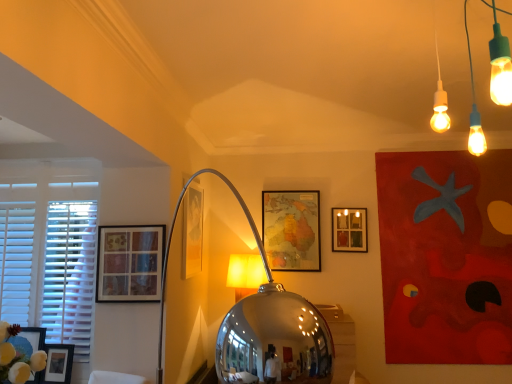
Find the location of a particular element. This screenshot has height=384, width=512. matte glass picture frame at center, arranged as the 3th picture frame when viewed from the right is located at coordinates click(x=192, y=231).

Describe the element at coordinates (130, 263) in the screenshot. The height and width of the screenshot is (384, 512). I see `matte glass picture frame at left, acting as the fourth picture frame starting from the right` at that location.

This screenshot has width=512, height=384. I want to click on matte glass picture frame at upper center, the fifth picture frame in the left-to-right sequence, so click(349, 230).

How much space does matte glass picture frame at upper center, the fifth picture frame in the left-to-right sequence, occupy vertically?

15.94 inches.

This screenshot has height=384, width=512. What do you see at coordinates (58, 363) in the screenshot?
I see `matte black picture frame at lower left, which is the fourth picture frame in back-to-front order` at bounding box center [58, 363].

You are a GUI agent. You are given a task and a screenshot of the screen. Output one action in this format:
    pyautogui.click(x=<x>, y=<y>)
    Task: Click on the matte wooden map at center, the 1th picture frame from the back
    
    Given the screenshot: What is the action you would take?
    pyautogui.click(x=291, y=230)

Measure the distance between point (274, 244) and camera.

A distance of 3.84 meters exists between point (274, 244) and camera.

This screenshot has height=384, width=512. I want to click on white matte window at left, so click(50, 247).

Looking at the image, does matte glass picture frame at left, acting as the fourth picture frame starting from the right, seem bigger or smaller compared to shiny metallic table lamp at center?

Considering their sizes, matte glass picture frame at left, acting as the fourth picture frame starting from the right, takes up less space than shiny metallic table lamp at center.

Can we say matte glass picture frame at left, which is the second picture frame in left-to-right order, lies outside shiny metallic table lamp at center?

Yes, matte glass picture frame at left, which is the second picture frame in left-to-right order, is not within shiny metallic table lamp at center.

Based on the photo, which of these two, matte glass picture frame at left, acting as the fourth picture frame starting from the right, or shiny metallic table lamp at center, stands shorter?

Standing shorter between the two is matte glass picture frame at left, acting as the fourth picture frame starting from the right.

At what (x,y) coordinates should I click in order to perform the action: click on the 1st picture frame above the shiny metallic table lamp at center (from the image's perspective). Please return your answer as a coordinate pair (x, y). The image size is (512, 384). Looking at the image, I should click on (130, 263).

Who is bigger, matte glass picture frame at center, marked as the 3th picture frame in a back-to-front arrangement, or shiny metallic table lamp at center?

shiny metallic table lamp at center is bigger.

From a real-world perspective, is matte glass picture frame at center, marked as the 3th picture frame in a back-to-front arrangement, positioned above or below shiny metallic table lamp at center?

In terms of real-world spatial position, matte glass picture frame at center, marked as the 3th picture frame in a back-to-front arrangement, is above shiny metallic table lamp at center.

Considering the positions of point (198, 271) and point (263, 278), is point (198, 271) closer or farther from the camera than point (263, 278)?

Point (198, 271).

From a real-world perspective, is shiny metallic table lamp at center positioned above or below matte glass picture frame at upper center, the fifth picture frame in the left-to-right sequence?

shiny metallic table lamp at center is below matte glass picture frame at upper center, the fifth picture frame in the left-to-right sequence.

What's the angular difference between shiny metallic table lamp at center and matte glass picture frame at upper center, the 2th picture frame positioned from the back,'s facing directions?

The angle between the facing direction of shiny metallic table lamp at center and the facing direction of matte glass picture frame at upper center, the 2th picture frame positioned from the back, is 41.8 degrees.

Is shiny metallic table lamp at center positioned far away from matte glass picture frame at upper center, placed as the first picture frame when sorted from right to left?

shiny metallic table lamp at center is actually quite close to matte glass picture frame at upper center, placed as the first picture frame when sorted from right to left.

Is shiny metallic table lamp at center in front of or behind matte glass picture frame at upper center, the fifth picture frame in the left-to-right sequence, in the image?

shiny metallic table lamp at center is in front of matte glass picture frame at upper center, the fifth picture frame in the left-to-right sequence.

Is shiny metallic table lamp at center directly adjacent to white matte window at left?

No, shiny metallic table lamp at center is not beside white matte window at left.

In the scene shown: How far apart are shiny metallic table lamp at center and white matte window at left?

The distance of shiny metallic table lamp at center from white matte window at left is 1.44 meters.

Is shiny metallic table lamp at center oriented away from white matte window at left?

No, shiny metallic table lamp at center is not facing the opposite direction of white matte window at left.

Looking at this image, how different are the orientations of shiny metallic table lamp at center and white matte window at left in degrees?

The angle between the facing direction of shiny metallic table lamp at center and the facing direction of white matte window at left is 43.6 degrees.

Is matte glass picture frame at center, arranged as the 3th picture frame when viewed from the right, turned away from matte glass picture frame at upper center, placed as the first picture frame when sorted from right to left?

matte glass picture frame at center, arranged as the 3th picture frame when viewed from the right, does not have its back to matte glass picture frame at upper center, placed as the first picture frame when sorted from right to left.

Can you tell me how much matte glass picture frame at center, which ranks as the third picture frame in front-to-back order, and matte glass picture frame at upper center, which is the 4th picture frame in front-to-back order, differ in facing direction?

89.1 degrees.

At what (x,y) coordinates should I click in order to perform the action: click on the 2nd picture frame to the left of the matte glass picture frame at upper center, placed as the first picture frame when sorted from right to left, starting your count from the anchor. Please return your answer as a coordinate pair (x, y). Looking at the image, I should click on (192, 231).

Considering the sizes of objects matte glass picture frame at center, which ranks as the third picture frame in left-to-right order, and matte glass picture frame at upper center, placed as the first picture frame when sorted from right to left, in the image provided, who is wider, matte glass picture frame at center, which ranks as the third picture frame in left-to-right order, or matte glass picture frame at upper center, placed as the first picture frame when sorted from right to left,?

Answer: matte glass picture frame at upper center, placed as the first picture frame when sorted from right to left.

Is there a large distance between white matte window at left and matte black picture frame at lower left, acting as the first picture frame starting from the left?

That's not correct — white matte window at left is a little close to matte black picture frame at lower left, acting as the first picture frame starting from the left.

Is white matte window at left in front of matte black picture frame at lower left, which is the fifth picture frame from right to left?

No, white matte window at left is behind matte black picture frame at lower left, which is the fifth picture frame from right to left.

From the image's perspective, does white matte window at left appear lower than matte black picture frame at lower left, which is the fourth picture frame in back-to-front order?

Actually, white matte window at left appears above matte black picture frame at lower left, which is the fourth picture frame in back-to-front order, in the image.

Can we say white matte window at left lies outside matte black picture frame at lower left, acting as the first picture frame starting from the left?

Absolutely, white matte window at left is external to matte black picture frame at lower left, acting as the first picture frame starting from the left.

Is point (275, 217) closer to viewer compared to point (79, 270)?

No, (275, 217) is behind (79, 270).

Is matte wooden map at center, the 4th picture frame viewed from the left, positioned in front of white matte window at left?

No, it is behind white matte window at left.

Is white matte window at left at the back of matte wooden map at center, marked as the 2th picture frame in a right-to-left arrangement?

That's not correct — matte wooden map at center, marked as the 2th picture frame in a right-to-left arrangement, is not looking away from white matte window at left.

This screenshot has height=384, width=512. What are the coordinates of `table lamp located underneath the matte glass picture frame at left, acting as the fourth picture frame starting from the right (from a real-world perspective)` in the screenshot? It's located at (x=245, y=274).

From the image's perspective, count 4th picture frames upward from the shiny metallic table lamp at center and point to it. Please provide its 2D coordinates.

[(192, 231)]

From the image, which object appears to be farther from matte black picture frame at lower left, acting as the first picture frame starting from the left, white matte window at left or matte glass picture frame at center, arranged as the 3th picture frame when viewed from the right?

matte glass picture frame at center, arranged as the 3th picture frame when viewed from the right.

Based on the photo, which object lies further to the anchor point matte wooden map at center, the 1th picture frame from the back, matte glass picture frame at upper center, placed as the first picture frame when sorted from right to left, or matte glass picture frame at left, arranged as the 5th picture frame when viewed from the back?

matte glass picture frame at left, arranged as the 5th picture frame when viewed from the back, is positioned further to the anchor matte wooden map at center, the 1th picture frame from the back.

Which object lies nearer to the anchor point matte glass picture frame at center, which ranks as the third picture frame in left-to-right order, matte wooden map at center, the 1th picture frame from the back, or matte black picture frame at lower left, which is the fifth picture frame from right to left?

matte wooden map at center, the 1th picture frame from the back, is positioned closer to the anchor matte glass picture frame at center, which ranks as the third picture frame in left-to-right order.

From the image, which object appears to be nearer to shiny metallic table lamp at center, matte glass picture frame at left, the 1th picture frame from the front, or matte black picture frame at lower left, marked as the 2th picture frame in a front-to-back arrangement?

Based on the image, matte glass picture frame at left, the 1th picture frame from the front, appears to be nearer to shiny metallic table lamp at center.

Considering their positions, is shiny metallic table lamp at center positioned closer to matte glass picture frame at left, the 1th picture frame from the front, than white matte window at left?

The object closer to matte glass picture frame at left, the 1th picture frame from the front, is white matte window at left.

Based on the photo, considering their positions, is matte glass picture frame at center, which ranks as the third picture frame in front-to-back order, positioned closer to matte glass picture frame at upper center, placed as the first picture frame when sorted from right to left, than shiny metallic table lamp at center?

shiny metallic table lamp at center.

From the image, which object appears to be nearer to matte glass picture frame at upper center, the fifth picture frame in the left-to-right sequence, white matte window at left or shiny metallic table lamp at center?

Based on the image, shiny metallic table lamp at center appears to be nearer to matte glass picture frame at upper center, the fifth picture frame in the left-to-right sequence.

When comparing their distances from white matte window at left, does matte wooden map at center, which ranks as the 5th picture frame in front-to-back order, or matte glass picture frame at left, the 1th picture frame from the front, seem closer?

matte glass picture frame at left, the 1th picture frame from the front, lies closer to white matte window at left than the other object.

In order to click on table lamp situated between matte black picture frame at lower left, which is the fifth picture frame from right to left, and matte glass picture frame at upper center, placed as the first picture frame when sorted from right to left, from left to right in this screenshot , I will do `click(245, 274)`.

This screenshot has height=384, width=512. In order to click on table lamp situated between white matte window at left and matte wooden map at center, the 1th picture frame from the back, from left to right in this screenshot , I will do `click(245, 274)`.

The height and width of the screenshot is (384, 512). In order to click on picture frame situated between matte glass picture frame at left, arranged as the 5th picture frame when viewed from the back, and shiny metallic table lamp at center from left to right in this screenshot , I will do `click(192, 231)`.

Locate an element on the screen. The width and height of the screenshot is (512, 384). picture frame situated between shiny metallic table lamp at center and matte glass picture frame at upper center, the 2th picture frame positioned from the back, from left to right is located at coordinates [x=291, y=230].